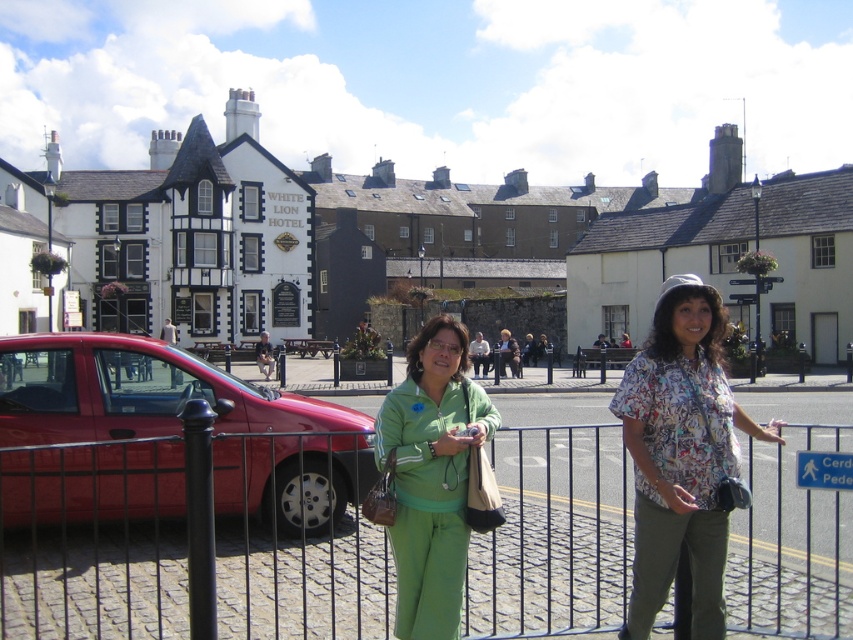
You are a photographer trying to capture a wide shot of the scene. The shiny red car at left and the printed fabric shirt at center are both important elements. Given their sizes, which object should you ensure stays fully in frame to avoid cropping?

The shiny red car at left is larger than the printed fabric shirt at center, so you should prioritize keeping the shiny red car at left fully in frame as it requires more space to avoid cropping.

You are a photographer standing behind the black metal fence. You want to take a photo of both the shiny red car at left and the printed fabric shirt at center. Can you fit both in the frame if your camera has a 5 meter field of view?

The shiny red car at left and the printed fabric shirt at center are 5.60 meters apart. Since the distance between them exceeds the camera field of view of 5 meters, you cannot fit both in the frame.

You are a photographer standing behind the black metal fence at center and want to take a photo of the shiny red car at left. Will the fence block your view of the car?

The black metal fence at center is in front of the shiny red car at left, so the fence will block your view of the car.